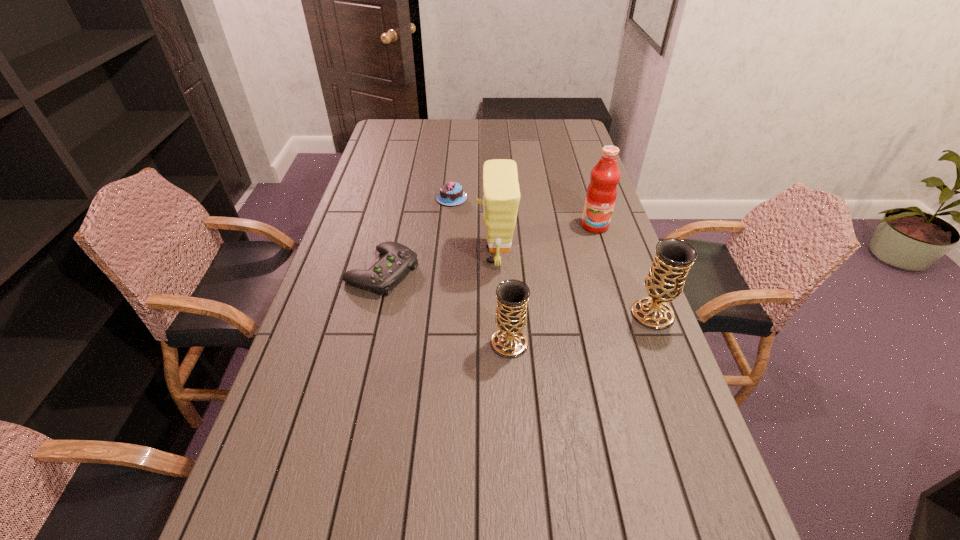
Where is `empty location between the left chalice and the fifth object from right to left`? The image size is (960, 540). empty location between the left chalice and the fifth object from right to left is located at coordinates (481, 271).

Identify the location of vacant point located between the left chalice and the control. (445, 307).

This screenshot has height=540, width=960. In order to click on vacant area that lies between the fruit juice and the sponge in this screenshot , I will do `click(545, 240)`.

This screenshot has height=540, width=960. I want to click on vacant area that lies between the sponge and the leftmost object, so click(x=439, y=263).

At what (x,y) coordinates should I click in order to perform the action: click on vacant space that's between the chocolate cake and the control. Please return your answer as a coordinate pair (x, y). The width and height of the screenshot is (960, 540). Looking at the image, I should click on (417, 235).

Select which object is the fifth closest to the second farthest object. Please provide its 2D coordinates. Your answer should be formatted as a tuple, i.e. [(x, y)], where the tuple contains the x and y coordinates of a point satisfying the conditions above.

[(398, 259)]

I want to click on object that is the fourth closest to the sponge, so click(601, 194).

Image resolution: width=960 pixels, height=540 pixels. I want to click on vacant space that satisfies the following two spatial constraints: 1. on the front side of the leftmost object; 2. on the left side of the shorter chalice, so click(x=365, y=343).

The image size is (960, 540). In order to click on free space that satisfies the following two spatial constraints: 1. on the face of the sponge; 2. on the left side of the right chalice in this screenshot , I will do `click(497, 314)`.

I want to click on vacant space that satisfies the following two spatial constraints: 1. on the face of the sponge; 2. on the left side of the left chalice, so click(x=498, y=343).